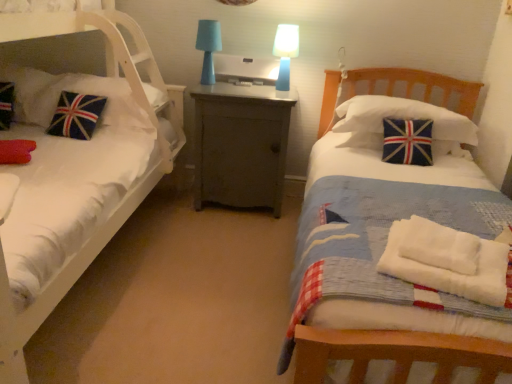
This screenshot has height=384, width=512. In order to click on vacant space positioned to the left of matte gray cabinet at center in this screenshot , I will do `click(164, 206)`.